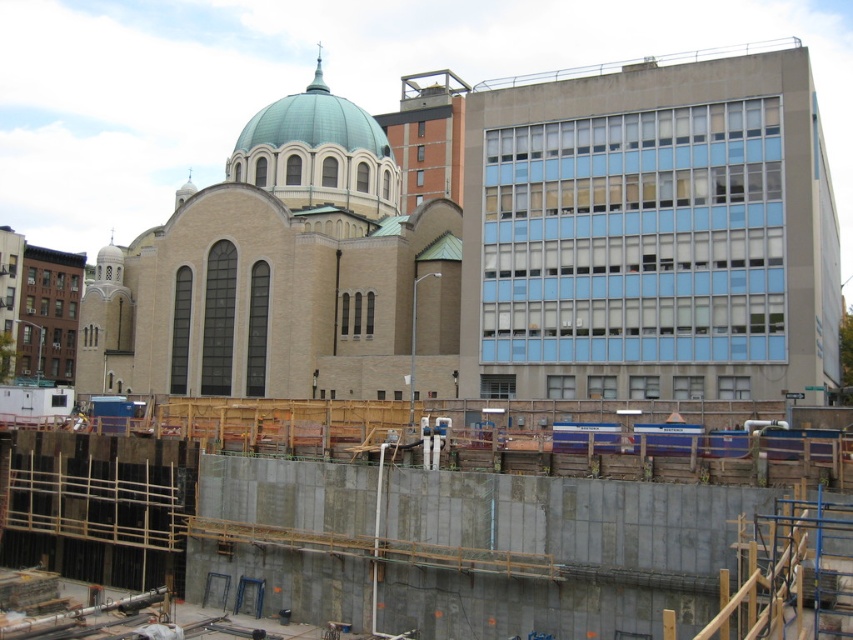
You are an architect visiting the construction site. You notice the beige stone church at center and the concrete wall at center. Which object is closer to you as you stand at the entrance of the construction site?

The beige stone church at center is closer to you than the concrete wall at center because it is further to the viewer.

You are a surveyor trying to determine the distance between two points in the construction site. You have a measuring tool that can only measure distances to objects within 0.5 units from the viewer. Do both points, point (447, 275) and point (465, 451), fall within this range?

Point (447, 275) is further to the viewer than point (465, 451). Since the measuring tool can only measure up to 0.5 units, both points are within range as their distances are less than 0.5 units from the viewer.

You are an architect evaluating the urban space. Considering the beige stone church at center and the concrete wall at center, which one has a greater height in the scene?

The beige stone church at center is taller than the concrete wall at center according to the description.